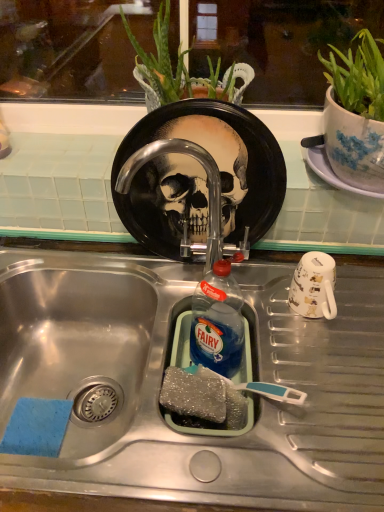
Question: Considering the relative positions of white glossy mug at right and stainless steel sink at center in the image provided, is white glossy mug at right to the right of stainless steel sink at center from the viewer's perspective?

Choices:
 (A) no
 (B) yes

Answer: (B)

Question: Considering the relative sizes of white glossy mug at right and stainless steel sink at center in the image provided, is white glossy mug at right taller than stainless steel sink at center?

Choices:
 (A) no
 (B) yes

Answer: (A)

Question: Does white glossy mug at right lie behind stainless steel sink at center?

Choices:
 (A) no
 (B) yes

Answer: (B)

Question: Is white glossy mug at right thinner than stainless steel sink at center?

Choices:
 (A) yes
 (B) no

Answer: (A)

Question: Is white glossy mug at right wider than stainless steel sink at center?

Choices:
 (A) no
 (B) yes

Answer: (A)

Question: From their relative heights in the image, would you say sparkly gray sponge at sink bottom is taller or shorter than green leafy plant at center?

Choices:
 (A) short
 (B) tall

Answer: (A)

Question: Do you think sparkly gray sponge at sink bottom is within green leafy plant at center, or outside of it?

Choices:
 (A) outside
 (B) inside

Answer: (A)

Question: In the image, is sparkly gray sponge at sink bottom positioned in front of or behind green leafy plant at center?

Choices:
 (A) front
 (B) behind

Answer: (A)

Question: In terms of width, does sparkly gray sponge at sink bottom look wider or thinner when compared to green leafy plant at center?

Choices:
 (A) thin
 (B) wide

Answer: (A)

Question: Is black glossy plate at center wider or thinner than stainless steel sink at center?

Choices:
 (A) thin
 (B) wide

Answer: (A)

Question: Does point (241, 170) appear closer or farther from the camera than point (321, 367)?

Choices:
 (A) closer
 (B) farther

Answer: (B)

Question: Would you say black glossy plate at center is to the left or to the right of stainless steel sink at center in the picture?

Choices:
 (A) left
 (B) right

Answer: (B)

Question: From a real-world perspective, is black glossy plate at center positioned above or below stainless steel sink at center?

Choices:
 (A) below
 (B) above

Answer: (B)

Question: Is green leafy plant at center bigger or smaller than white glossy mug at right?

Choices:
 (A) small
 (B) big

Answer: (B)

Question: From the image's perspective, is green leafy plant at center above or below white glossy mug at right?

Choices:
 (A) above
 (B) below

Answer: (A)